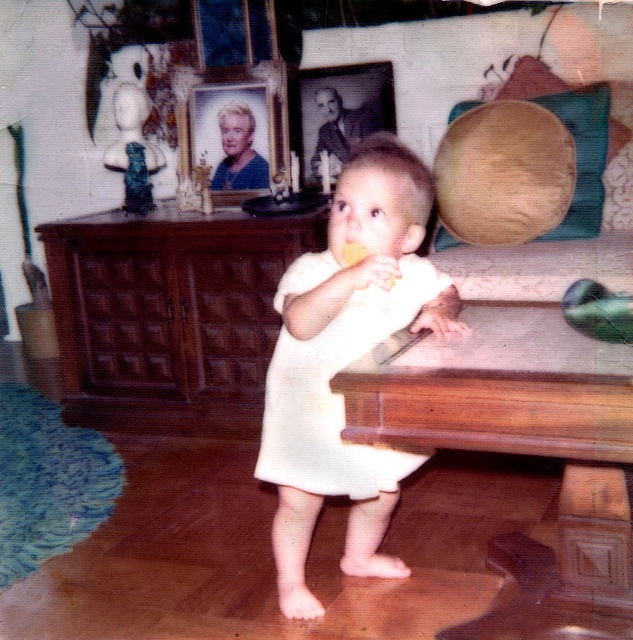
Question: Is black glossy photo frame at upper center thinner than yellow matte food at center?

Choices:
 (A) no
 (B) yes

Answer: (A)

Question: Based on their relative distances, which object is farther from the yellow matte food at center?

Choices:
 (A) wooden picture frame at upper center
 (B) wooden table at center
 (C) black glossy photo frame at upper center
 (D) white cotton dress at center

Answer: (C)

Question: Is wooden picture frame at upper center smaller than yellow matte food at center?

Choices:
 (A) no
 (B) yes

Answer: (A)

Question: Can you confirm if white matte dress at center is thinner than black glossy photo frame at upper center?

Choices:
 (A) no
 (B) yes

Answer: (A)

Question: Based on their relative distances, which object is nearer to the black glossy photo frame at upper center?

Choices:
 (A) wooden table at center
 (B) wooden picture frame at upper center
 (C) yellow matte food at center
 (D) white cotton dress at center

Answer: (B)

Question: Which object is the closest to the white cotton dress at center?

Choices:
 (A) wooden picture frame at upper center
 (B) black glossy photo frame at upper center
 (C) wooden table at center

Answer: (C)